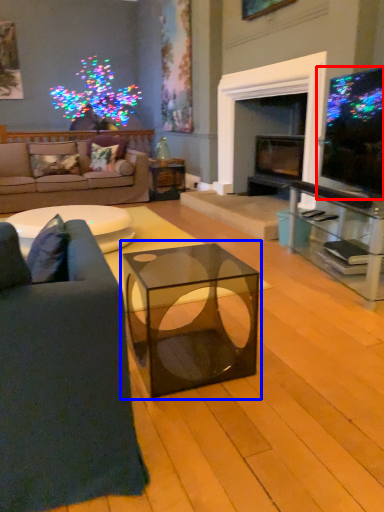
Question: Among these objects, which one is farthest to the camera, television (highlighted by a red box) or coffee table (highlighted by a blue box)?

Choices:
 (A) television
 (B) coffee table

Answer: (A)